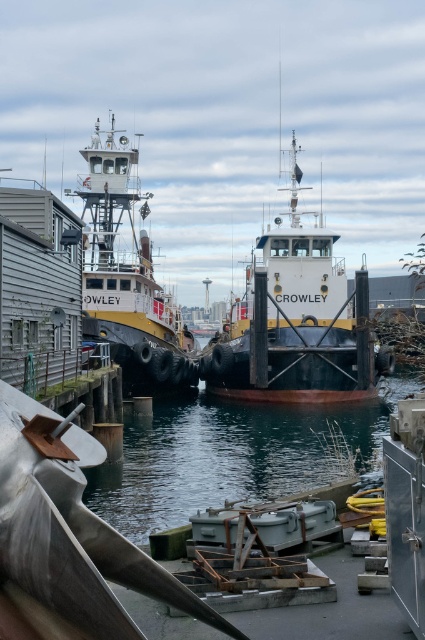
You are a dock worker who needs to secure a rope from the yellow matte tugboat at left to an anchor in the clear water at center. Based on the scene, can you directly attach the rope to the anchor without needing to go around any obstacles?

The clear water at center is in front of the yellow matte tugboat at left, meaning the anchor in the clear water at center is directly accessible from the tugboat. Therefore, you can attach the rope directly without needing to go around obstacles.

You are standing on the pier and want to walk from point A to point B. Point A is at coordinates point (166, 458) and point B is at coordinates point (85, 314). Which direction should you walk to reach point B from point A?

To reach point B from point A, you should walk backward since point A is in front of point B.